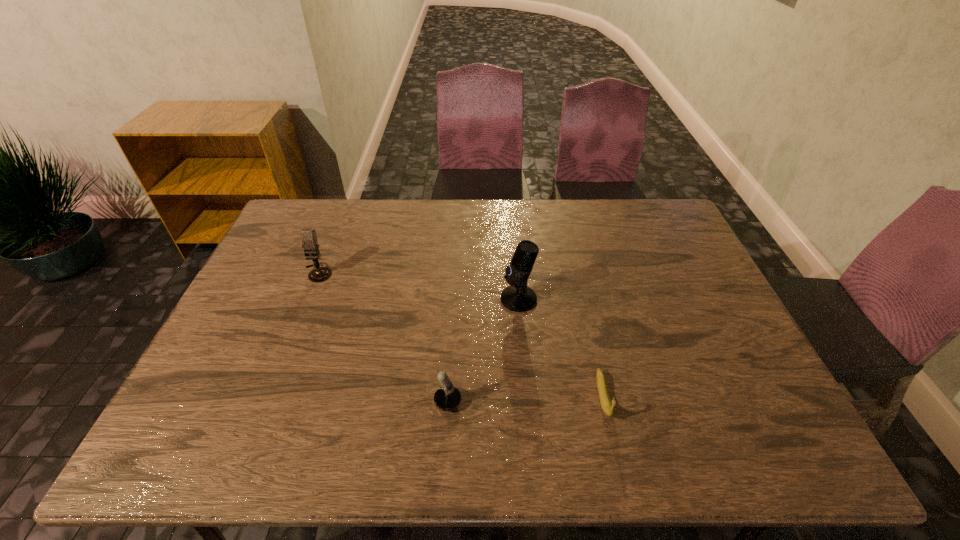
I want to click on blank area located 0.380m on the stand of the tallest microphone, so click(370, 299).

At what (x,y) coordinates should I click in order to perform the action: click on free space located on the front-facing side of the leftmost object. Please return your answer as a coordinate pair (x, y). Image resolution: width=960 pixels, height=540 pixels. Looking at the image, I should click on (307, 299).

Image resolution: width=960 pixels, height=540 pixels. Identify the location of vacant region located 0.280m on the back of the second microphone from left to right. (438, 306).

This screenshot has width=960, height=540. Find the location of `vacant space positioned 0.080m at the stem of the rightmost object`. vacant space positioned 0.080m at the stem of the rightmost object is located at coordinates (617, 457).

The height and width of the screenshot is (540, 960). Identify the location of object positioned at the left edge. (310, 244).

This screenshot has width=960, height=540. I want to click on free space at the far edge of the desktop, so click(470, 214).

Find the location of a particular element. Image resolution: width=960 pixels, height=540 pixels. free space at the near edge of the desktop is located at coordinates (632, 426).

Identify the location of vacant point at the right edge. (648, 264).

In the image, there is a desktop. In order to click on free space at the far left corner in this screenshot , I will do `click(317, 205)`.

In the image, there is a desktop. Where is `free space at the far right corner`? This screenshot has width=960, height=540. free space at the far right corner is located at coordinates (620, 199).